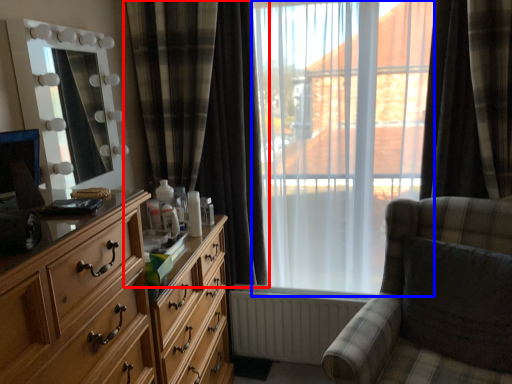
Question: Which of the following is the closest to the observer, curtain (highlighted by a red box) or bay window (highlighted by a blue box)?

Choices:
 (A) curtain
 (B) bay window

Answer: (B)